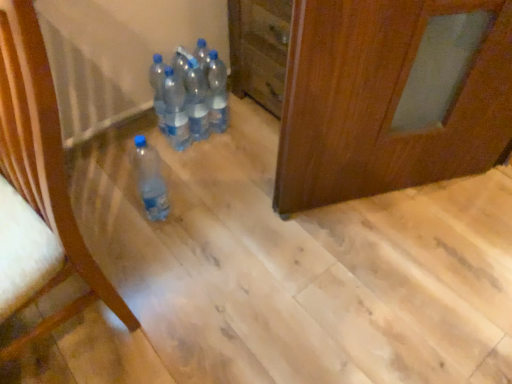
Find the location of a particular element. Image resolution: width=512 pixels, height=384 pixels. free spot to the right of transparent plastic bottles at center, placed as the 5th bottle when sorted from left to right is located at coordinates (250, 130).